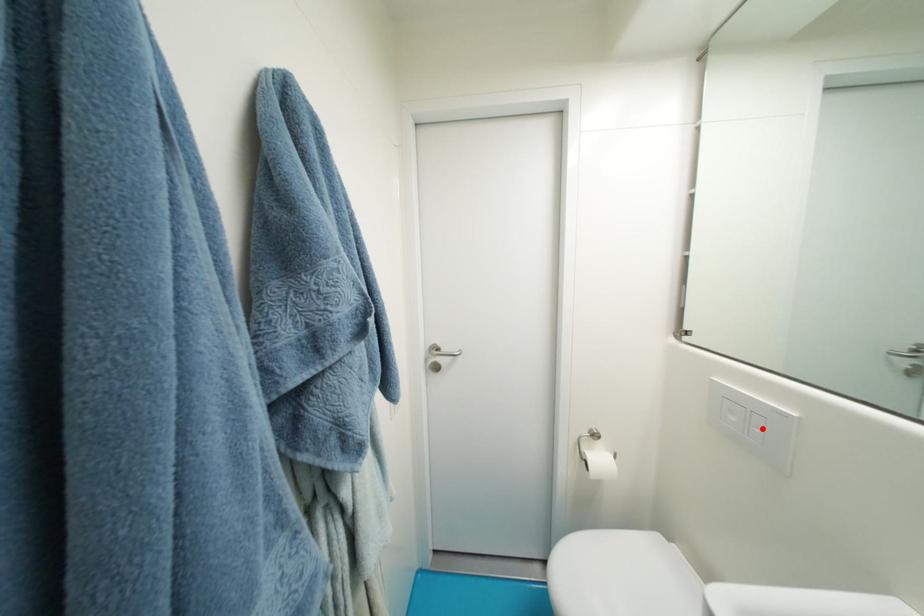
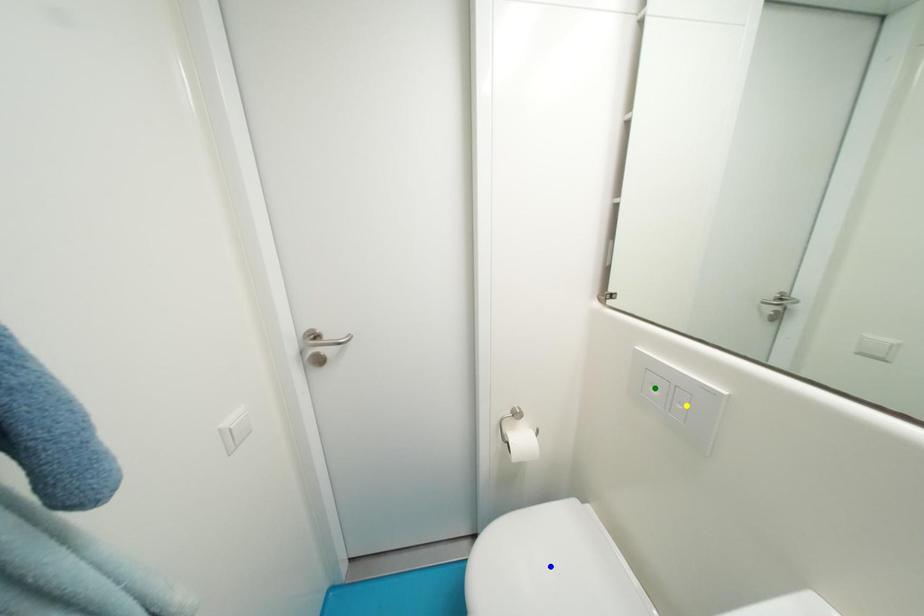
Question: I am providing you with two images of the same scene from different viewpoints. A red point is marked on the first image. You are given multiple points on the second image. Which point in image 2 is actually the same real-world point as the red point in image 1?

Choices:
 (A) green point
 (B) blue point
 (C) yellow point

Answer: (C)